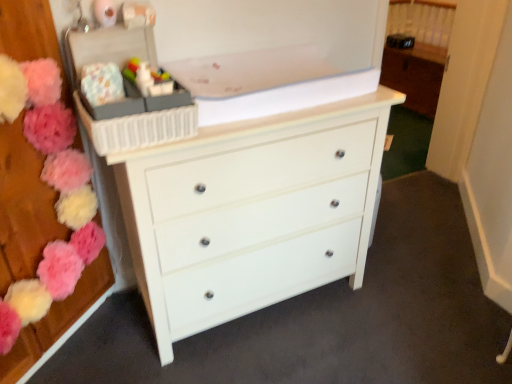
Identify the location of free space above plastic storage box at upper left (from a real-world perspective). (99, 22).